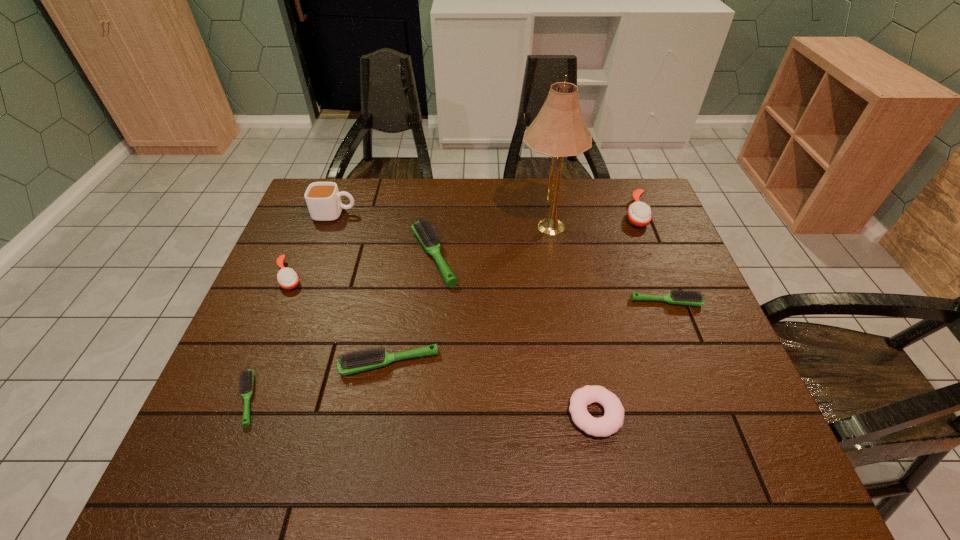
At what (x,y) coordinates should I click in order to perform the action: click on beige lampshade. Please return your answer as a coordinate pair (x, y). Looking at the image, I should click on (559, 130).

The image size is (960, 540). I want to click on lampshade, so click(x=559, y=130).

This screenshot has width=960, height=540. Identify the location of cup. (323, 199).

You are a GUI agent. You are given a task and a screenshot of the screen. Output one action in this format:
    pyautogui.click(x=<x>, y=<y>)
    Task: Click on the eighth shortest object
    This screenshot has height=540, width=960.
    Given the screenshot: What is the action you would take?
    pyautogui.click(x=323, y=199)

Where is `the right orange hairbrush`? Image resolution: width=960 pixels, height=540 pixels. the right orange hairbrush is located at coordinates (639, 214).

You are a GUI agent. You are given a task and a screenshot of the screen. Output one action in this format:
    pyautogui.click(x=<x>, y=<y>)
    Task: Click on the farther orange hairbrush
    
    Given the screenshot: What is the action you would take?
    [x=639, y=214]

Find the location of a particular element. The width and height of the screenshot is (960, 540). the farthest light hairbrush is located at coordinates (427, 235).

Find the location of `the second biggest light hairbrush`. the second biggest light hairbrush is located at coordinates (359, 361).

You are a GUI agent. You are given a task and a screenshot of the screen. Output one action in this format:
    pyautogui.click(x=<x>, y=<y>)
    Task: Click on the nearer orange hairbrush
    The height and width of the screenshot is (540, 960).
    Given the screenshot: What is the action you would take?
    pyautogui.click(x=287, y=278)

Where is `the smaller orange hairbrush`? The width and height of the screenshot is (960, 540). the smaller orange hairbrush is located at coordinates (287, 278).